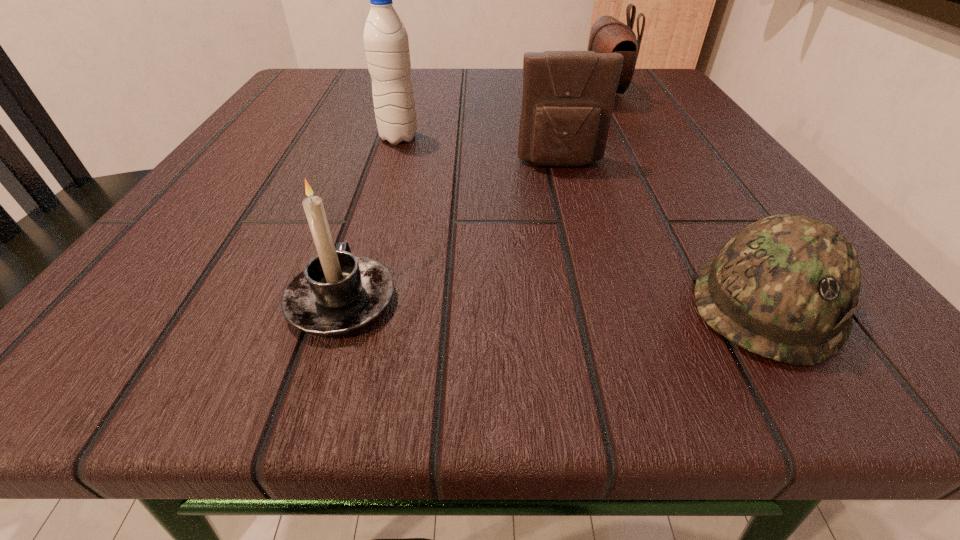
The width and height of the screenshot is (960, 540). In order to click on the tallest object in this screenshot , I will do `click(386, 43)`.

Locate an element on the screen. water bottle is located at coordinates (386, 43).

What are the coordinates of `the third object from right to left` in the screenshot? It's located at (568, 97).

Identify the location of the nearer pouch. (568, 97).

You are a GUI agent. You are given a task and a screenshot of the screen. Output one action in this format:
    pyautogui.click(x=<x>, y=<y>)
    Task: Click on the farther pouch
    The height and width of the screenshot is (540, 960).
    Given the screenshot: What is the action you would take?
    pyautogui.click(x=608, y=35)

The height and width of the screenshot is (540, 960). I want to click on the right pouch, so click(608, 35).

The image size is (960, 540). I want to click on candle holder, so click(x=336, y=293).

At what (x,y) coordinates should I click in order to perform the action: click on the shortest object. Please return your answer as a coordinate pair (x, y). This screenshot has width=960, height=540. Looking at the image, I should click on point(785,287).

I want to click on vacant region located on the left of the tallest object, so click(329, 138).

This screenshot has width=960, height=540. What are the coordinates of `vacant space located 0.090m with an open flap on the left pouch` in the screenshot? It's located at (573, 209).